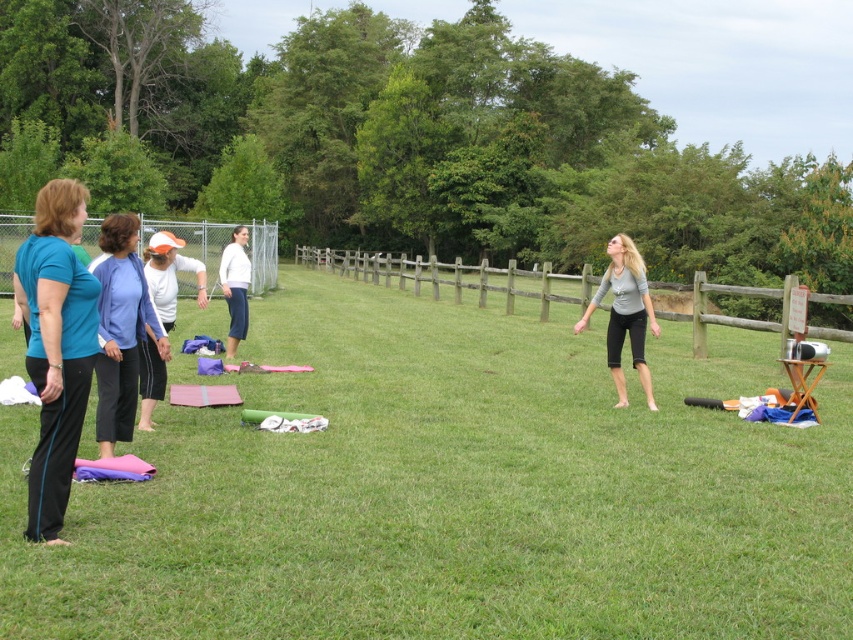
Is teal matte shirt at left to the right of white cotton shirt at center-left from the viewer's perspective?

Indeed, teal matte shirt at left is positioned on the right side of white cotton shirt at center-left.

Is point (44, 316) positioned before point (172, 292)?

Yes, it is in front of point (172, 292).

Identify the location of teal matte shirt at left. The image size is (853, 640). (56, 346).

Is white cotton shirt at center-left to the right of white matte pants at center from the viewer's perspective?

Yes, white cotton shirt at center-left is to the right of white matte pants at center.

Is white cotton shirt at center-left below white matte pants at center?

Indeed, white cotton shirt at center-left is positioned under white matte pants at center.

Is point (144, 403) positioned behind point (242, 276)?

No, (144, 403) is closer to viewer.

I want to click on white cotton shirt at center-left, so click(170, 275).

Does green grass at center have a greater width compared to wooden fence at center?

No.

Who is positioned more to the right, green grass at center or wooden fence at center?

Positioned to the right is wooden fence at center.

Which is behind, point (651, 483) or point (741, 326)?

The point (741, 326) is behind.

Locate an element on the screen. green grass at center is located at coordinates (450, 488).